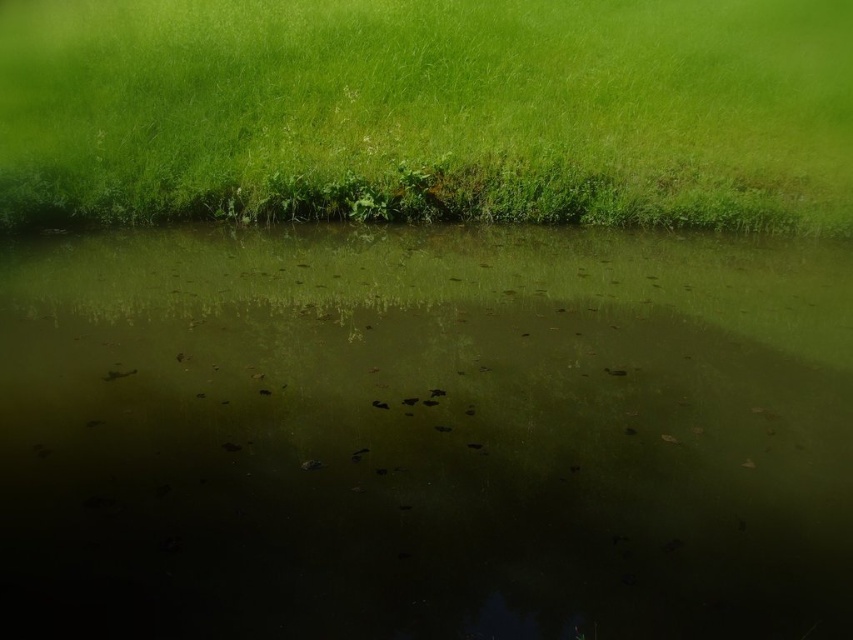
Measure the distance between point (698, 554) and camera.

A distance of 3.76 meters exists between point (698, 554) and camera.

Which of these two, green murky water at center or green grassy at upper center, stands taller?

green grassy at upper center

Between point (103, 403) and point (613, 32), which one is positioned in front?

Point (103, 403) is in front.

At what (x,y) coordinates should I click in order to perform the action: click on green murky water at center. Please return your answer as a coordinate pair (x, y). Image resolution: width=853 pixels, height=640 pixels. Looking at the image, I should click on (424, 435).